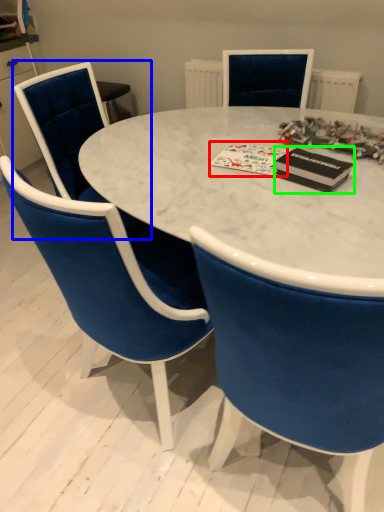
Question: Which object is positioned closest to christmas card (highlighted by a red box)? Select from chair (highlighted by a blue box) and magazine (highlighted by a green box).

Choices:
 (A) chair
 (B) magazine

Answer: (B)